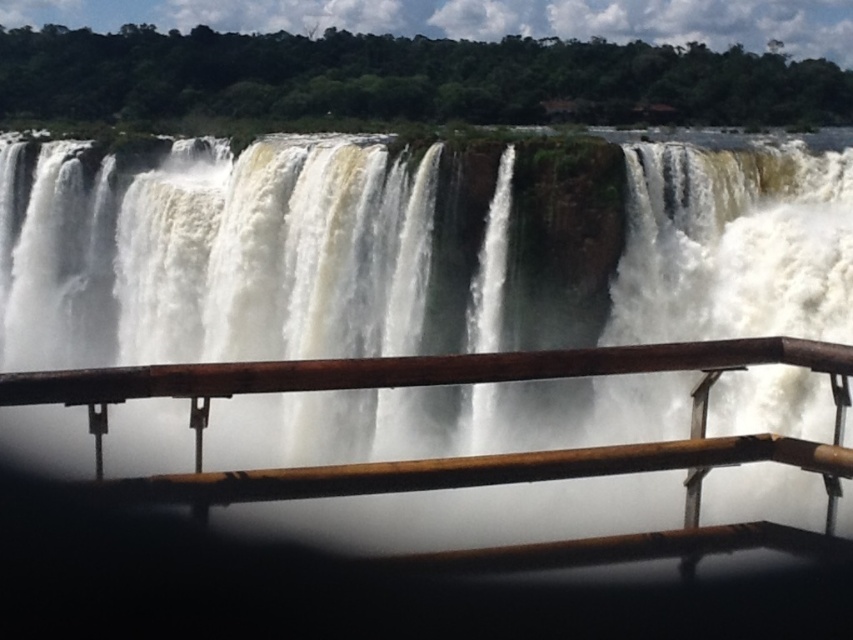
Question: Is white frothy water at center in front of brown wooden rail at center?

Choices:
 (A) no
 (B) yes

Answer: (A)

Question: In this image, where is white frothy water at center located relative to brown wooden rail at center?

Choices:
 (A) left
 (B) right

Answer: (A)

Question: Does white frothy water at center appear on the right side of brown wooden rail at center?

Choices:
 (A) no
 (B) yes

Answer: (A)

Question: Which of the following is the closest to the observer?

Choices:
 (A) (103, 428)
 (B) (218, 234)

Answer: (A)